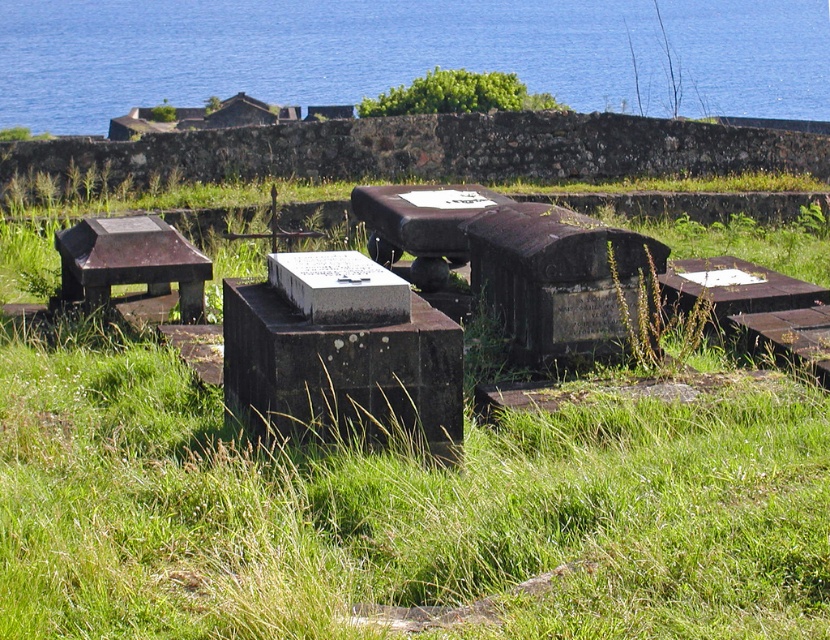
Question: Does blue water at upper center have a smaller size compared to rustic wood bench at left?

Choices:
 (A) yes
 (B) no

Answer: (B)

Question: Can you confirm if blue water at upper center is wider than rustic wood bench at left?

Choices:
 (A) no
 (B) yes

Answer: (B)

Question: Among these points, which one is farthest from the camera?

Choices:
 (A) (67, 268)
 (B) (413, 51)

Answer: (B)

Question: Does blue water at upper center appear over rustic wood bench at left?

Choices:
 (A) yes
 (B) no

Answer: (A)